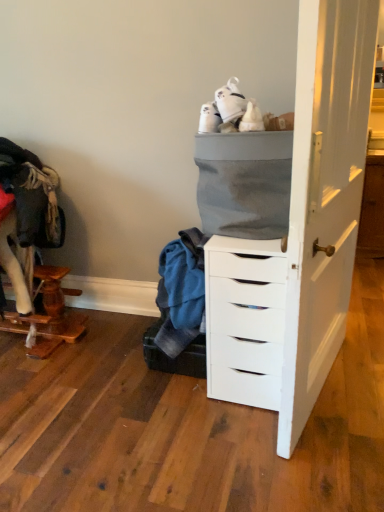
Question: From a real-world perspective, is wooden cat tree at left above or below white matte chest of drawers at center?

Choices:
 (A) above
 (B) below

Answer: (B)

Question: From the image's perspective, relative to white matte chest of drawers at center, is wooden cat tree at left above or below?

Choices:
 (A) above
 (B) below

Answer: (B)

Question: Considering the real-world distances, which object is farthest from the wooden cat tree at left?

Choices:
 (A) white matte chest of drawers at center
 (B) gray fabric basket at upper center

Answer: (B)

Question: Considering the real-world distances, which object is farthest from the wooden cat tree at left?

Choices:
 (A) gray fabric basket at upper center
 (B) white matte chest of drawers at center

Answer: (A)